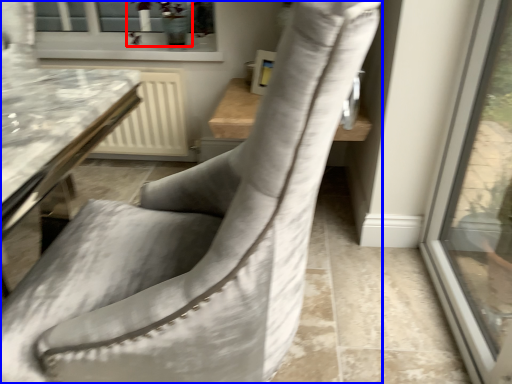
Question: Which point is further to the camera, plant (highlighted by a red box) or chair (highlighted by a blue box)?

Choices:
 (A) plant
 (B) chair

Answer: (A)